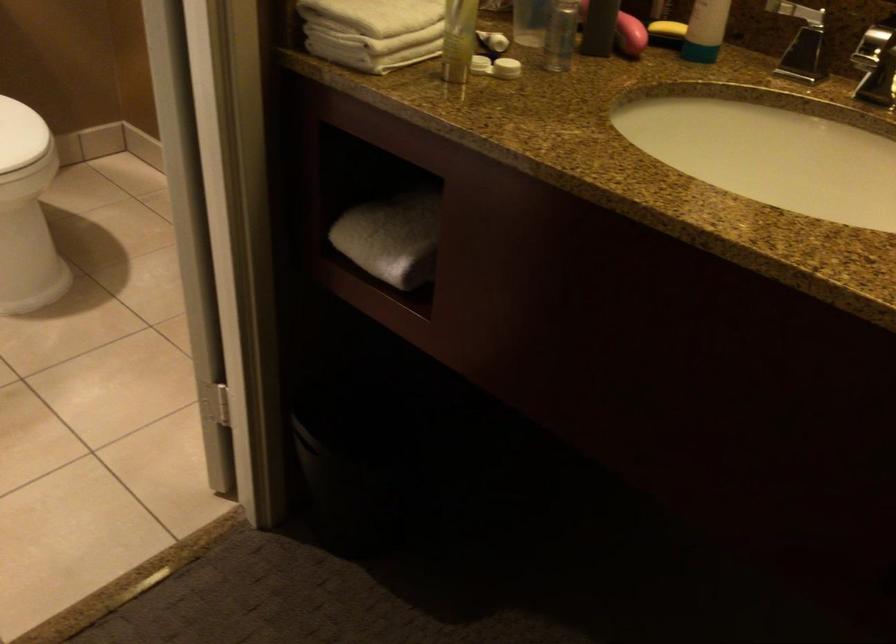
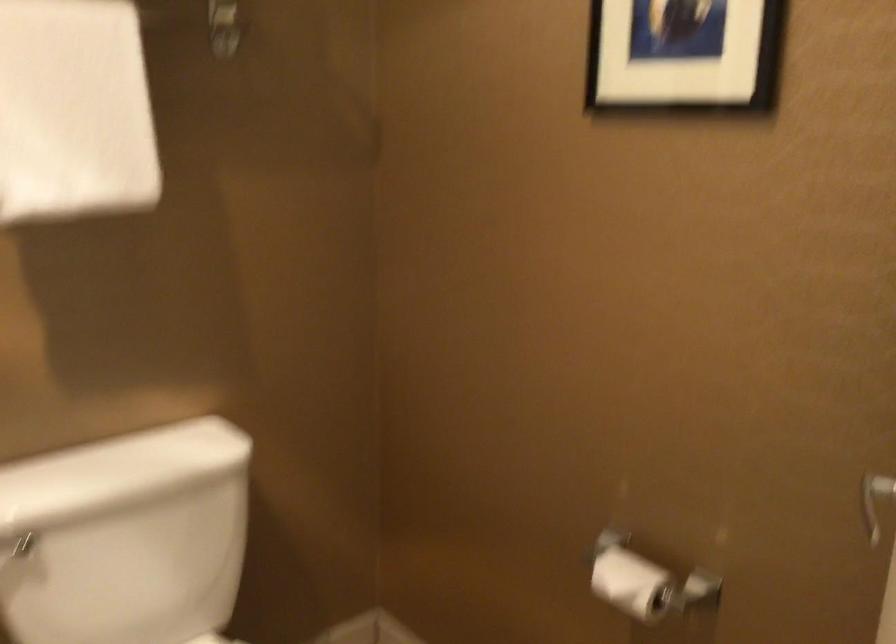
Which direction would the cameraman need to move to produce the second image?

The cameraman moved toward left, forward.